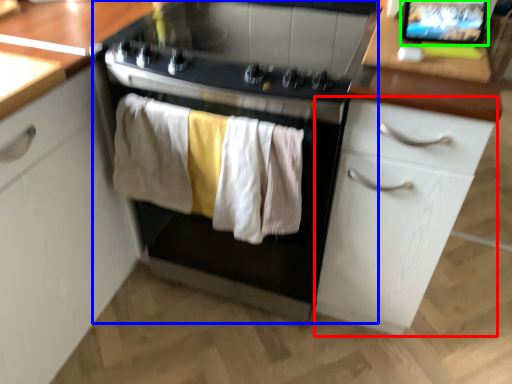
Question: Considering the real-world distances, which object is farthest from cabinetry (highlighted by a red box)? home appliance (highlighted by a blue box) or computer screen (highlighted by a green box)?

Choices:
 (A) home appliance
 (B) computer screen

Answer: (B)